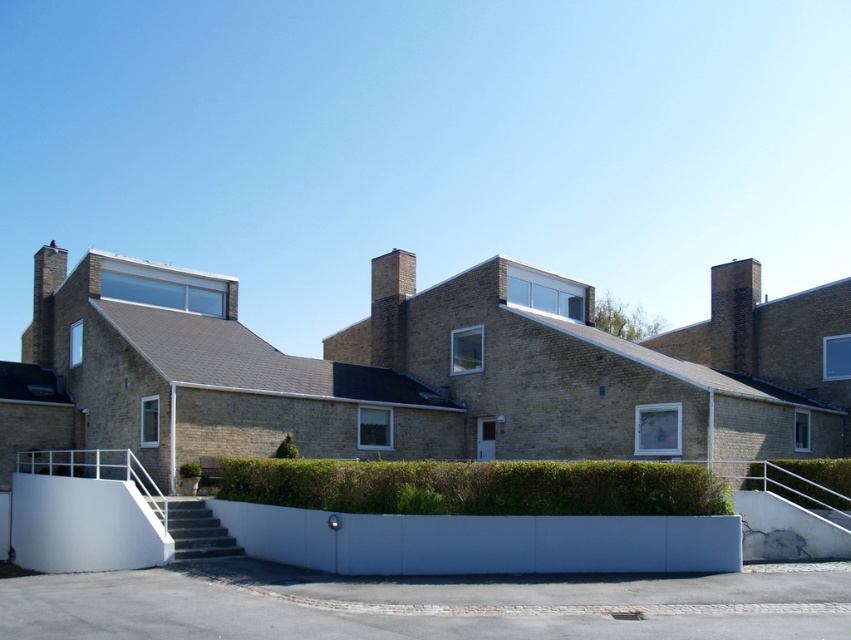
You are a gardener planning to trim the green leafy hedge at center and the green leafy hedge at lower right. Based on their heights, which hedge should you prioritize trimming first?

The green leafy hedge at center is much taller than the green leafy hedge at lower right, so you should prioritize trimming the green leafy hedge at center first.

You are standing in front of the modern residential building. Where is the green leafy hedge at center located?

The green leafy hedge at center is located at point (x=477, y=486).

You are a gardener planning to water the green leafy hedge at center and the green leafy hedge at lower right. If your watering can holds enough water for 10 feet of travel between plants, will you need to refill it before moving from one to the other?

The green leafy hedge at center and green leafy hedge at lower right are 20.88 feet apart, so you will need to refill your watering can before moving from one to the other since the distance exceeds the 10 feet capacity.